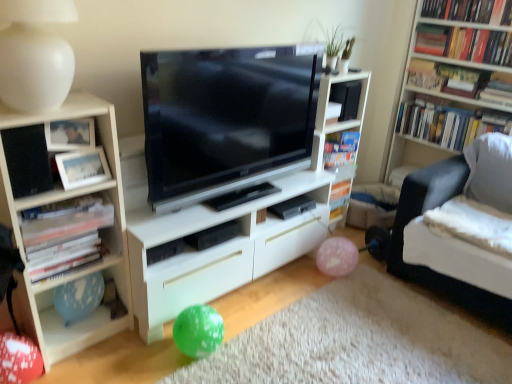
Question: From the image's perspective, is light wood bookcase at left under white matte lamp at upper left?

Choices:
 (A) no
 (B) yes

Answer: (B)

Question: Is light wood bookcase at left facing away from white matte lamp at upper left?

Choices:
 (A) no
 (B) yes

Answer: (A)

Question: Can we say light wood bookcase at left lies outside white matte lamp at upper left?

Choices:
 (A) yes
 (B) no

Answer: (A)

Question: From a real-world perspective, is light wood bookcase at left on white matte lamp at upper left?

Choices:
 (A) yes
 (B) no

Answer: (B)

Question: Can you confirm if light wood bookcase at left is thinner than white matte lamp at upper left?

Choices:
 (A) no
 (B) yes

Answer: (B)

Question: Is matte black speaker at left, positioned as the first speaker in bottom-to-top order, spatially inside white matte lamp at upper left, or outside of it?

Choices:
 (A) inside
 (B) outside

Answer: (B)

Question: Considering the positions of matte black speaker at left, the first speaker when ordered from left to right, and white matte lamp at upper left in the image, is matte black speaker at left, the first speaker when ordered from left to right, wider or thinner than white matte lamp at upper left?

Choices:
 (A) wide
 (B) thin

Answer: (B)

Question: Is matte black speaker at left, which ranks as the 2th speaker in top-to-bottom order, in front of or behind white matte lamp at upper left in the image?

Choices:
 (A) front
 (B) behind

Answer: (B)

Question: From the image's perspective, is matte black speaker at left, which is the second speaker from back to front, above or below white matte lamp at upper left?

Choices:
 (A) above
 (B) below

Answer: (B)

Question: In the image, is hardcover book at upper right, placed as the 2th book when sorted from top to bottom, positioned in front of or behind white matte bookshelf at left, which is counted as the fifth book, starting from the top?

Choices:
 (A) front
 (B) behind

Answer: (B)

Question: From the image's perspective, is hardcover book at upper right, the 5th book when ordered from left to right, above or below white matte bookshelf at left, which is counted as the fifth book, starting from the top?

Choices:
 (A) above
 (B) below

Answer: (A)

Question: Is hardcover book at upper right, the 5th book when ordered from left to right, wider or thinner than white matte bookshelf at left, which is counted as the fifth book, starting from the top?

Choices:
 (A) thin
 (B) wide

Answer: (A)

Question: Considering the positions of hardcover book at upper right, placed as the 2th book when sorted from top to bottom, and white matte bookshelf at left, placed as the 1th book when sorted from bottom to top, in the image, is hardcover book at upper right, placed as the 2th book when sorted from top to bottom, taller or shorter than white matte bookshelf at left, placed as the 1th book when sorted from bottom to top,?

Choices:
 (A) tall
 (B) short

Answer: (B)

Question: From a real-world perspective, is black matte paperback book at center positioned above or below black matte speaker at upper right, the 1th speaker from the top?

Choices:
 (A) above
 (B) below

Answer: (B)

Question: Considering the positions of black matte paperback book at center and black matte speaker at upper right, which is the first speaker from right to left, in the image, is black matte paperback book at center taller or shorter than black matte speaker at upper right, which is the first speaker from right to left,?

Choices:
 (A) short
 (B) tall

Answer: (A)